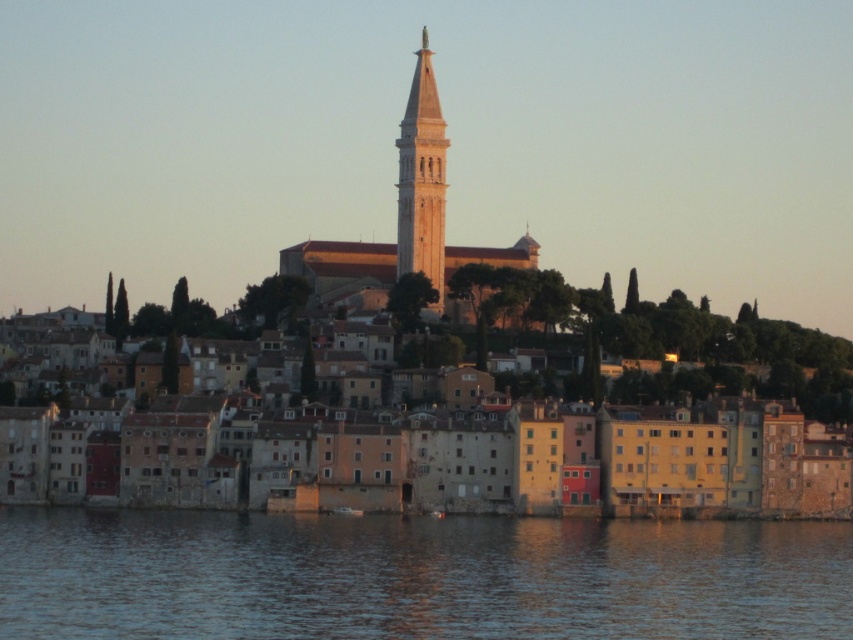
Based on the scene description, what is located at the coordinates point (x=416, y=577)?

The blue water at lower center is located at point (x=416, y=577).

You are a tourist standing on the beach looking towards the town. You see the stone buildings at center and the light beige stone bell tower at center. Which one is positioned to the right when facing the town?

The stone buildings at center are positioned to the right of the light beige stone bell tower at center.

You are a tourist visiting the coastal town and want to take a photo that includes both the blue water at lower center and the stone buildings at center. Based on their sizes in the image, which object should you position closer to the center of your photo to ensure it takes up more space?

The stone buildings at center are larger in the image compared to the blue water at lower center, so positioning the stone buildings at center closer to the center of your photo will ensure it takes up more space.